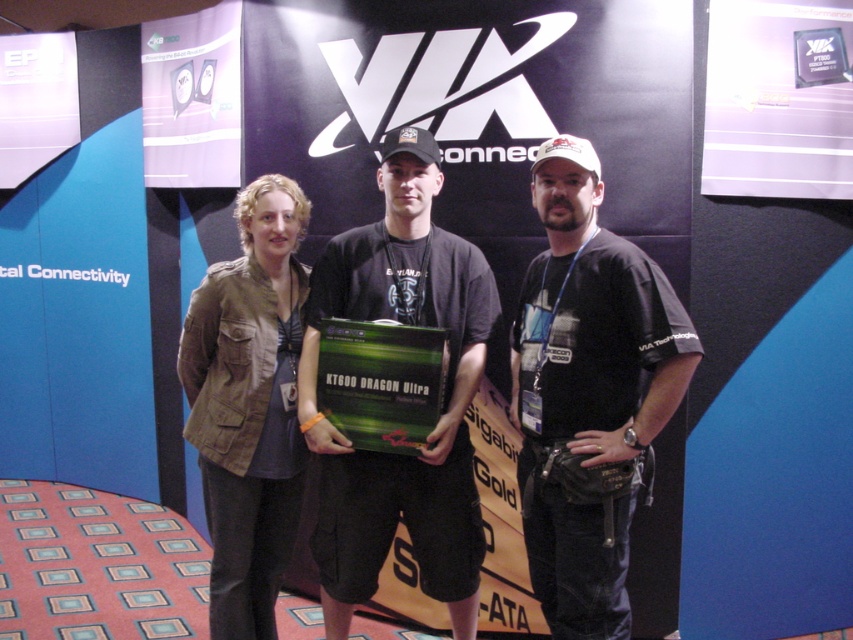
Who is positioned more to the left, black fabric t-shirt at center or matte black shirt at center?

matte black shirt at center

Which is in front, point (538, 593) or point (355, 252)?

Point (538, 593) is more forward.

This screenshot has height=640, width=853. Identify the location of black fabric t-shirt at center. (592, 326).

Between black fabric t-shirt at center and khaki fabric jacket at left, which one appears on the left side from the viewer's perspective?

khaki fabric jacket at left

Which is behind, point (595, 595) or point (181, 337)?

The point (181, 337) is more distant.

What do you see at coordinates (592, 326) in the screenshot? I see `black fabric t-shirt at center` at bounding box center [592, 326].

Identify the location of black fabric t-shirt at center. The width and height of the screenshot is (853, 640). pos(592,326).

Who is lower down, matte black shirt at center or khaki fabric jacket at left?

Positioned lower is khaki fabric jacket at left.

From the picture: Is matte black shirt at center thinner than khaki fabric jacket at left?

Incorrect, matte black shirt at center's width is not less than khaki fabric jacket at left's.

Locate an element on the screen. This screenshot has width=853, height=640. matte black shirt at center is located at coordinates (440, 412).